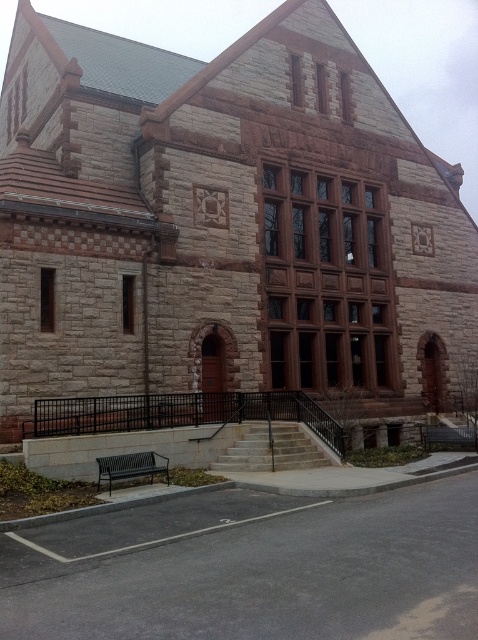
Question: Which point is farther to the camera?

Choices:
 (A) (457, 337)
 (B) (140, 476)

Answer: (A)

Question: Does brown stone church at center have a smaller size compared to black metal bench at lower left?

Choices:
 (A) yes
 (B) no

Answer: (B)

Question: Does brown stone church at center appear under black metal bench at lower left?

Choices:
 (A) no
 (B) yes

Answer: (A)

Question: Among these objects, which one is farthest from the camera?

Choices:
 (A) brown stone church at center
 (B) black metal bench at lower left

Answer: (A)

Question: Is brown stone church at center positioned in front of black metal bench at lower left?

Choices:
 (A) yes
 (B) no

Answer: (B)